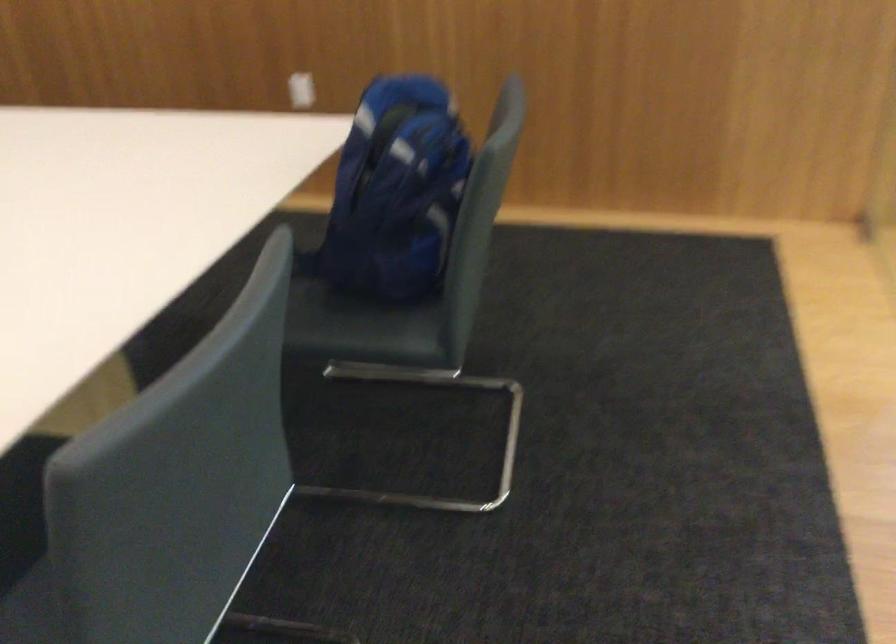
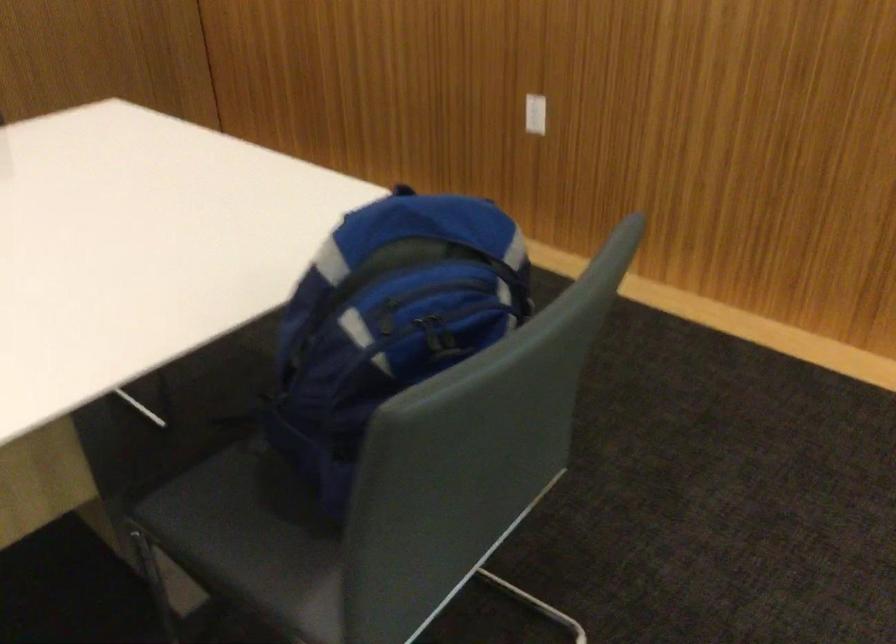
Question: The camera is either moving clockwise (left) or counter-clockwise (right) around the object. The first image is from the beginning of the video and the second image is from the end. Is the camera moving left or right when shooting the video?

Choices:
 (A) Left
 (B) Right

Answer: (B)